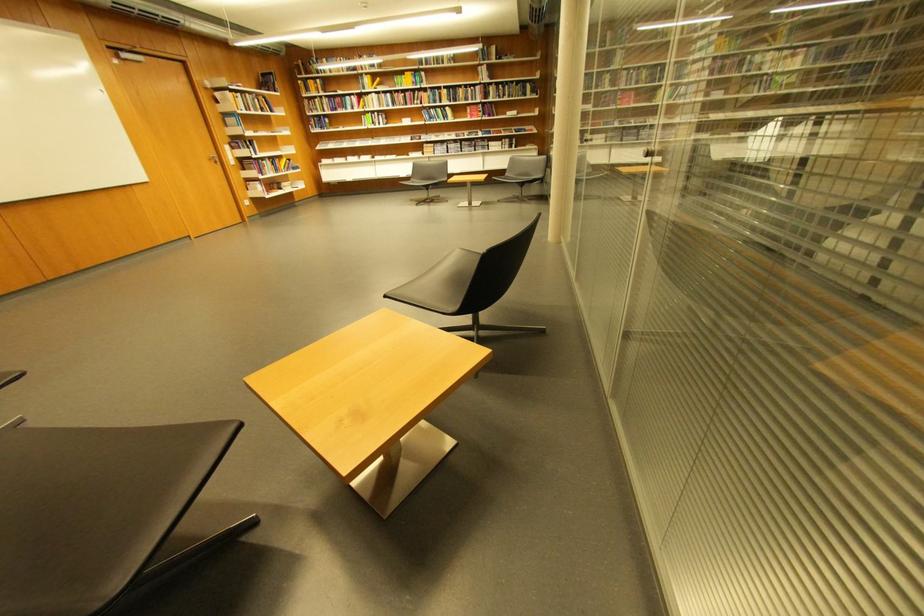
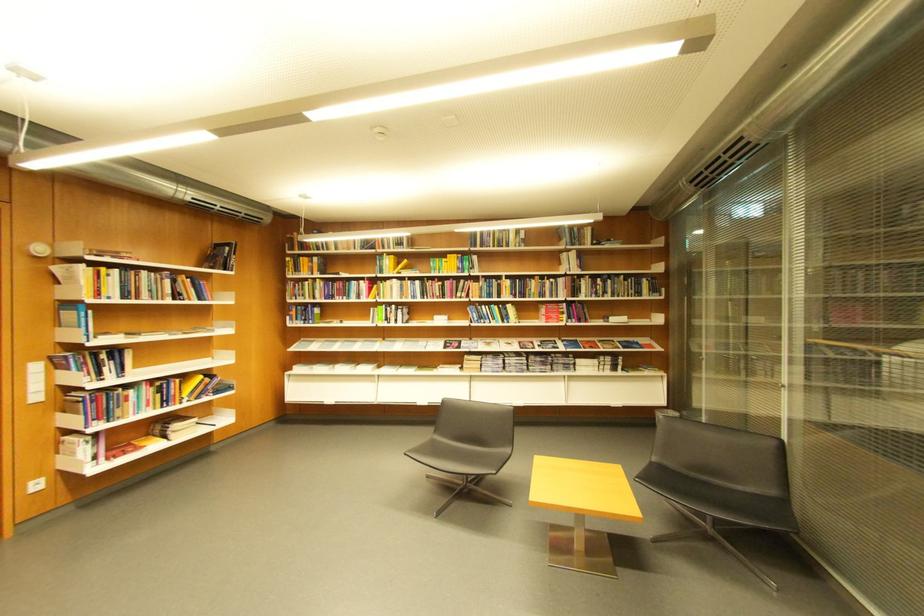
Question: In a continuous first-person perspective shot, in which direction is the camera moving?

Choices:
 (A) Left
 (B) Right
 (C) Forward
 (D) Backward

Answer: (C)